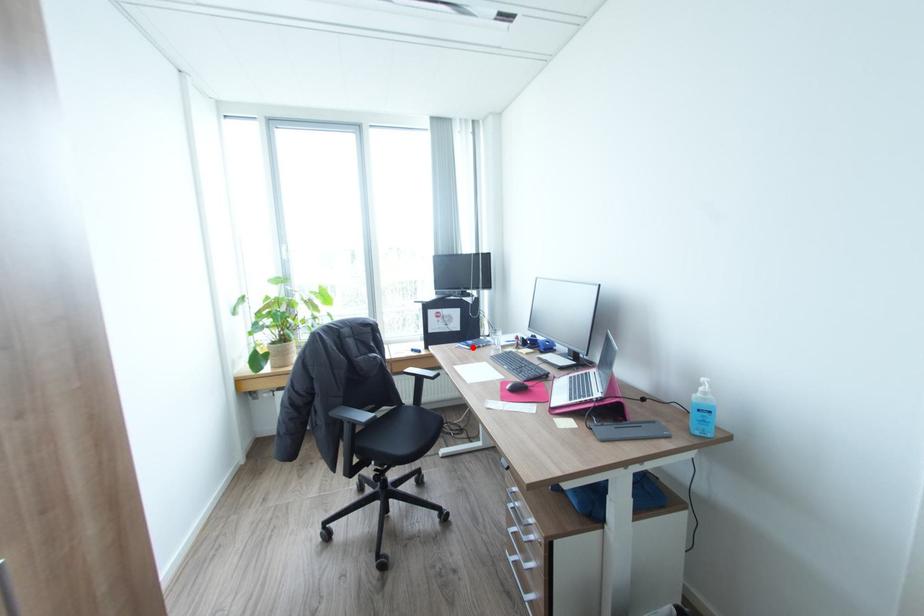
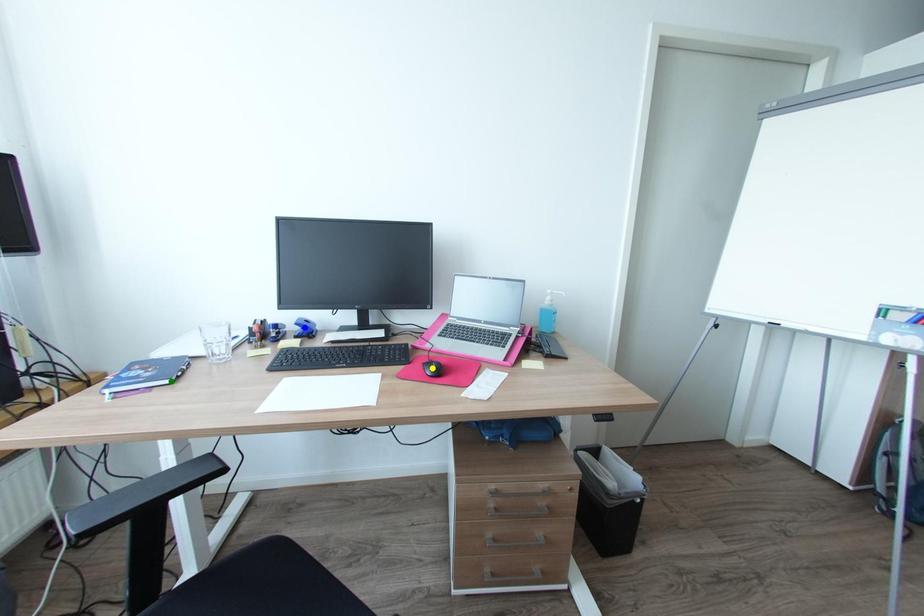
Question: I am providing you with two images of the same scene from different viewpoints. A red point is marked on the first image. You are given multiple points on the second image. Which point in image 2 is actually the same real-world point as the red point in image 1?

Choices:
 (A) blue point
 (B) yellow point
 (C) green point

Answer: (C)